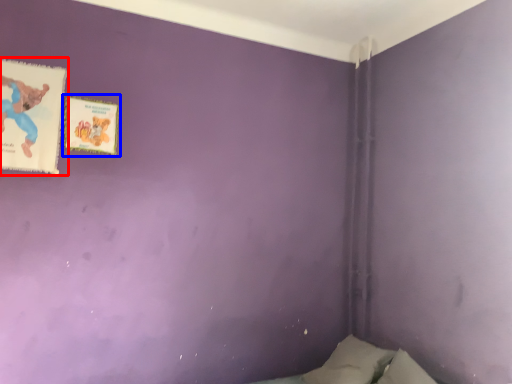
Question: Which object appears closest to the camera in this image, paperback book (highlighted by a red box) or paperback book (highlighted by a blue box)?

Choices:
 (A) paperback book
 (B) paperback book

Answer: (A)